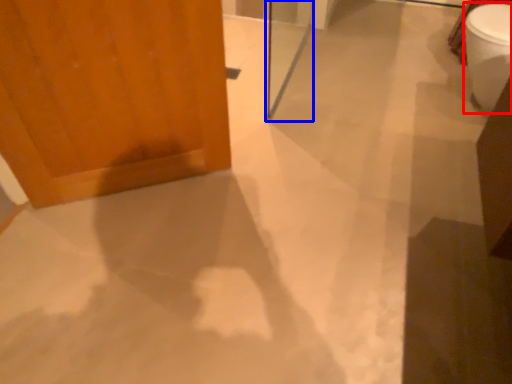
Question: Among these objects, which one is farthest to the camera, toilet bowl (highlighted by a red box) or screen door (highlighted by a blue box)?

Choices:
 (A) toilet bowl
 (B) screen door

Answer: (A)